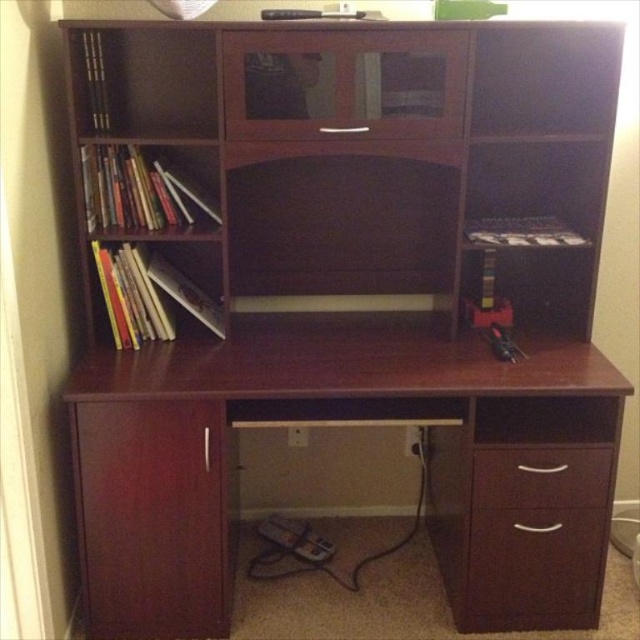
Question: Which object appears farthest from the camera in this image?

Choices:
 (A) matte wood drawer at lower right
 (B) dark wood drawer at lower right

Answer: (A)

Question: Can you confirm if matte wood drawer at lower right is positioned to the left of dark wood drawer at lower right?

Choices:
 (A) yes
 (B) no

Answer: (A)

Question: Which point appears closest to the camera in this image?

Choices:
 (A) (573, 564)
 (B) (477, 481)
 (C) (547, 556)

Answer: (B)

Question: Among these objects, which one is nearest to the camera?

Choices:
 (A) mahogany wood desk at center
 (B) dark wood drawer at lower right
 (C) matte wood drawer at lower right

Answer: (A)

Question: Where is matte wood drawer at lower right located in relation to dark wood drawer at lower right in the image?

Choices:
 (A) below
 (B) above

Answer: (A)

Question: Does mahogany wood desk at center appear on the left side of matte wood drawer at lower right?

Choices:
 (A) no
 (B) yes

Answer: (B)